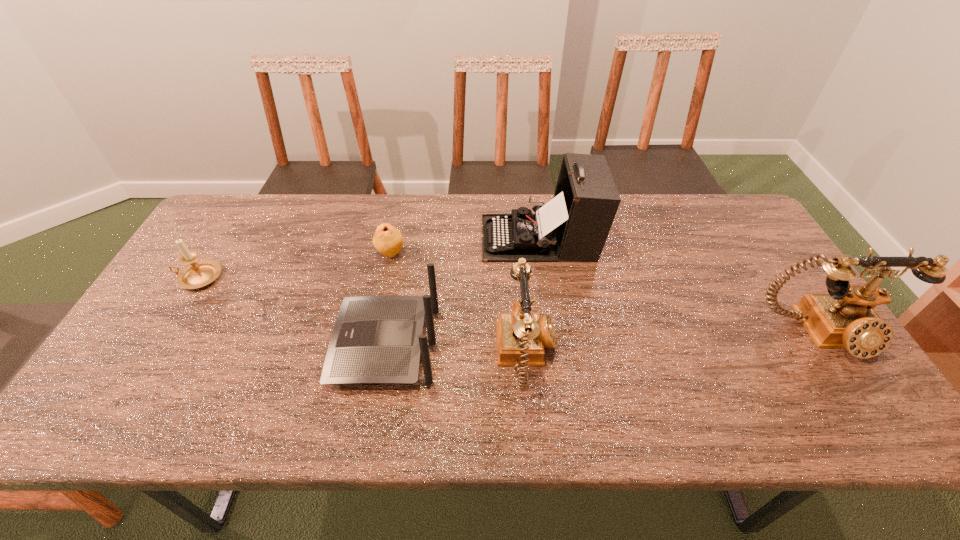
All telephones are currently evenly spaced. To continue this pattern, where would you add another telephone on the left? Please point out a vacant spot. Please provide its 2D coordinates. Your answer should be formatted as a tuple, i.e. [(x, y)], where the tuple contains the x and y coordinates of a point satisfying the conditions above.

[(206, 380)]